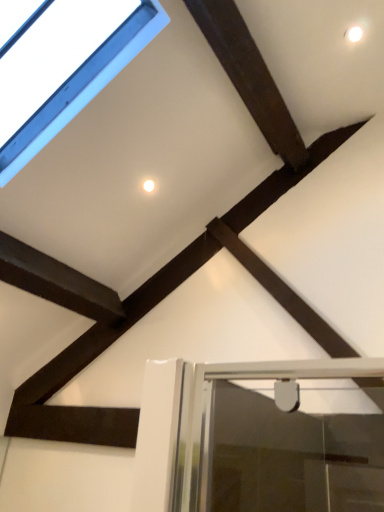
Measure the distance between transparent glass window at upper left and camera.

A distance of 2.20 meters exists between transparent glass window at upper left and camera.

The height and width of the screenshot is (512, 384). Find the location of `transparent glass window at upper left`. transparent glass window at upper left is located at coordinates (64, 68).

What do you see at coordinates (64, 68) in the screenshot? I see `transparent glass window at upper left` at bounding box center [64, 68].

The height and width of the screenshot is (512, 384). In order to click on transparent glass window at upper left in this screenshot , I will do `click(64, 68)`.